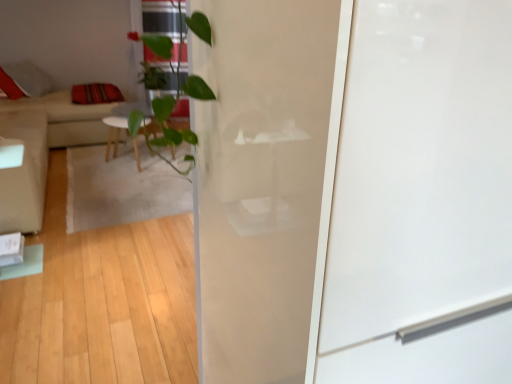
Question: In terms of size, does striped fabric pillow at left appear bigger or smaller than transparent glass screen door at center?

Choices:
 (A) small
 (B) big

Answer: (A)

Question: Visually, is striped fabric pillow at left positioned to the left or to the right of transparent glass screen door at center?

Choices:
 (A) left
 (B) right

Answer: (A)

Question: Considering the real-world distances, which object is closest to the beige fabric couch at left?

Choices:
 (A) transparent glass screen door at center
 (B) beige fabric armchair at left
 (C) striped fabric pillow at left

Answer: (C)

Question: Which is nearer to the beige fabric couch at left?

Choices:
 (A) beige fabric armchair at left
 (B) striped fabric pillow at left
 (C) transparent glass screen door at center

Answer: (B)